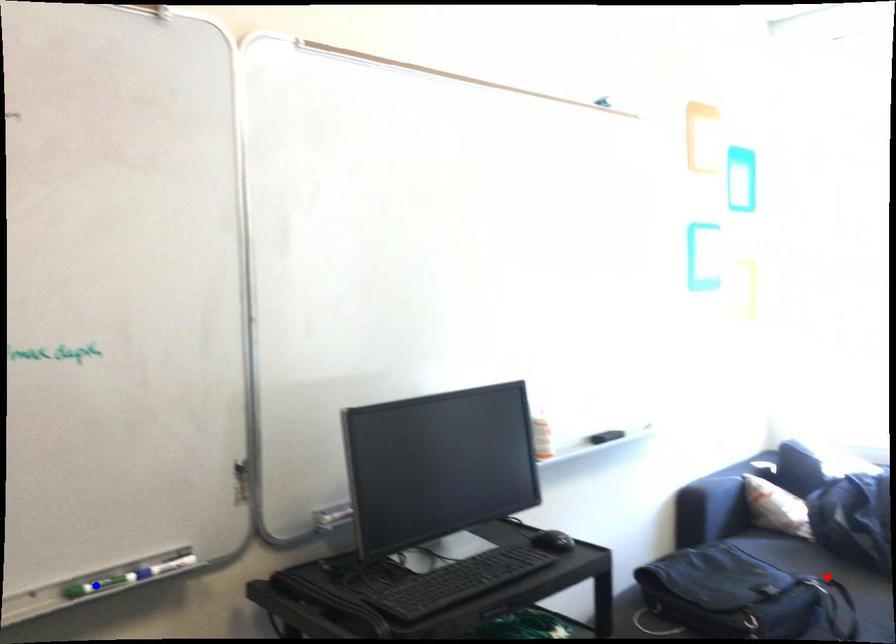
Question: In the image, two points are highlighted. Which point is nearer to the camera? Reply with the corresponding letter.

Choices:
 (A) blue point
 (B) red point

Answer: (A)